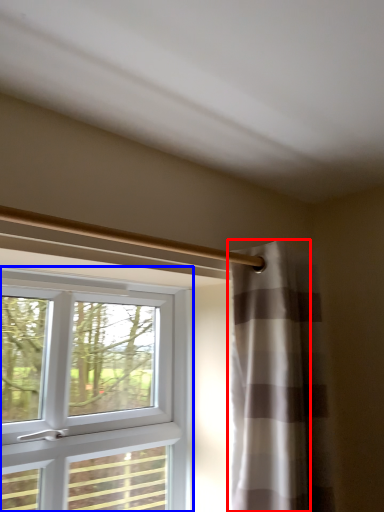
Question: Which object is further to the camera taking this photo, curtain (highlighted by a red box) or window (highlighted by a blue box)?

Choices:
 (A) curtain
 (B) window

Answer: (A)